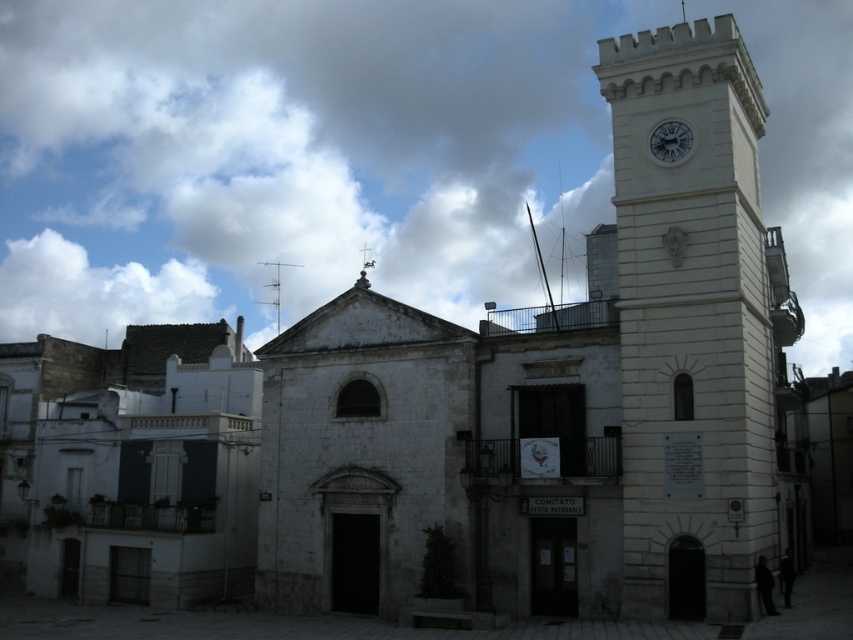
Consider the image. You are standing in front of the historic building and want to take a photo that includes both the white stone clock tower at right and the matte white clock at upper right. Which object should you ensure is in the foreground to capture both in the frame?

You should ensure the matte white clock at upper right is in the foreground because the white stone clock tower at right is taller and might block the view of the smaller matte white clock at upper right if positioned behind it.

You are an architect examining the historic building. You need to determine the spatial relationship between the matte white clock at upper right and the silver metallic cross at upper center. Based on the scene description, which object is positioned higher on the building?

The matte white clock at upper right is located above the silver metallic cross at upper center, so it is positioned higher on the building.